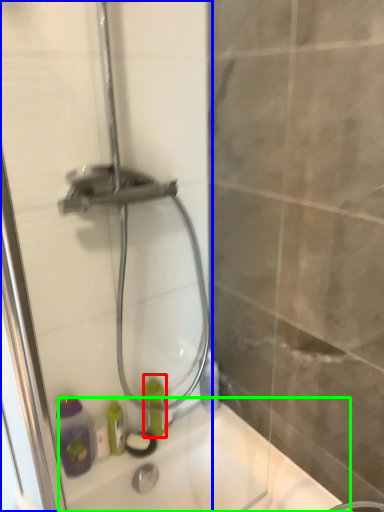
Question: Which object is positioned farthest from bottle (highlighted by a red box)? Select from shower door (highlighted by a blue box) and bath (highlighted by a green box).

Choices:
 (A) shower door
 (B) bath

Answer: (A)